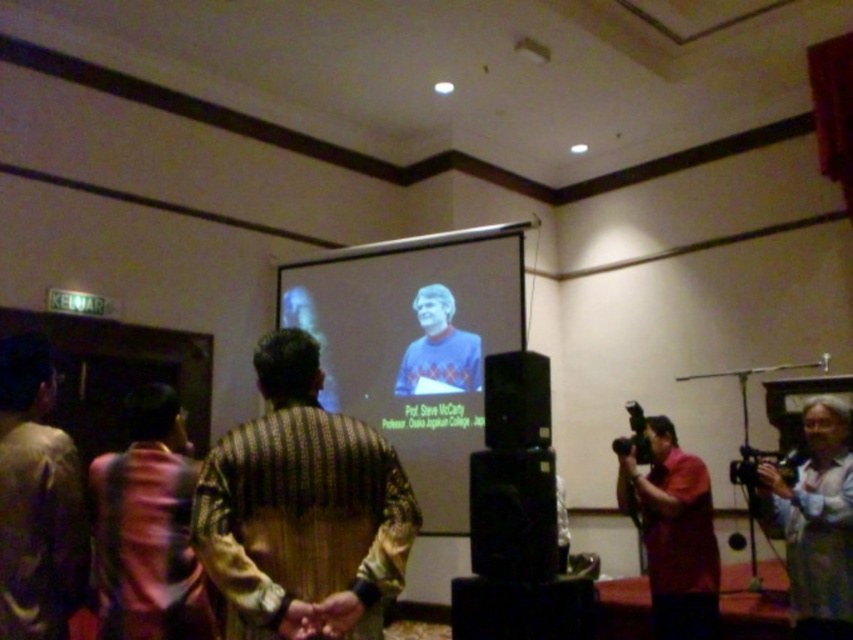
Question: Does black plastic speaker at lower center have a smaller size compared to black plastic video camera at lower right?

Choices:
 (A) no
 (B) yes

Answer: (A)

Question: Estimate the real-world distances between objects in this image. Which object is farther from the light blue shirt at center?

Choices:
 (A) black plastic speaker at lower center
 (B) patterned fabric shirt at center
 (C) blue sweater at center
 (D) pink fabric camera at lower right

Answer: (C)

Question: Which point appears farthest from the camera in this image?

Choices:
 (A) (323, 612)
 (B) (465, 260)
 (C) (645, 426)
 (D) (523, 445)

Answer: (B)

Question: Which of these objects is positioned farthest from the black plastic speaker at lower center?

Choices:
 (A) pink fabric camera at lower right
 (B) dark brown textured shirt at left
 (C) matte white screen at center

Answer: (B)

Question: Does light blue shirt at center come in front of pink fabric camera at lower right?

Choices:
 (A) yes
 (B) no

Answer: (A)

Question: Does light blue shirt at center have a larger size compared to black plastic speaker at lower center?

Choices:
 (A) no
 (B) yes

Answer: (B)